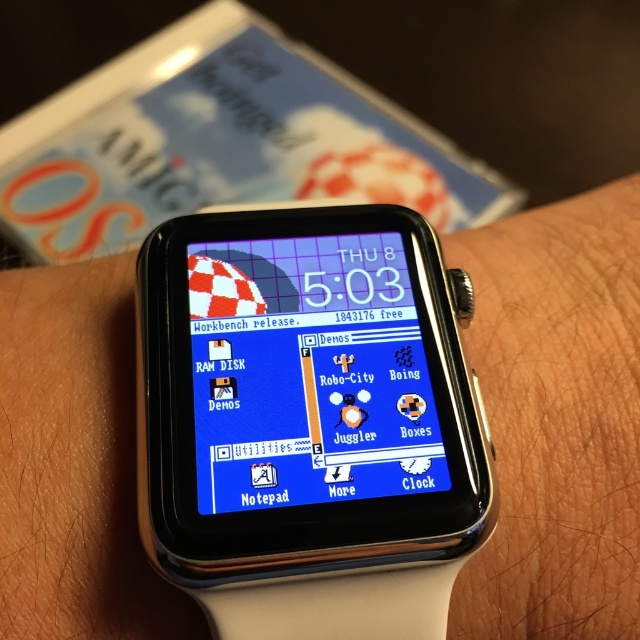
Is satin black watch at center closer to the viewer compared to blue glossy watch face at center?

Yes.

Does satin black watch at center have a greater width compared to blue glossy watch face at center?

Indeed, satin black watch at center has a greater width compared to blue glossy watch face at center.

What are the coordinates of `satin black watch at center` in the screenshot? It's located at (307, 420).